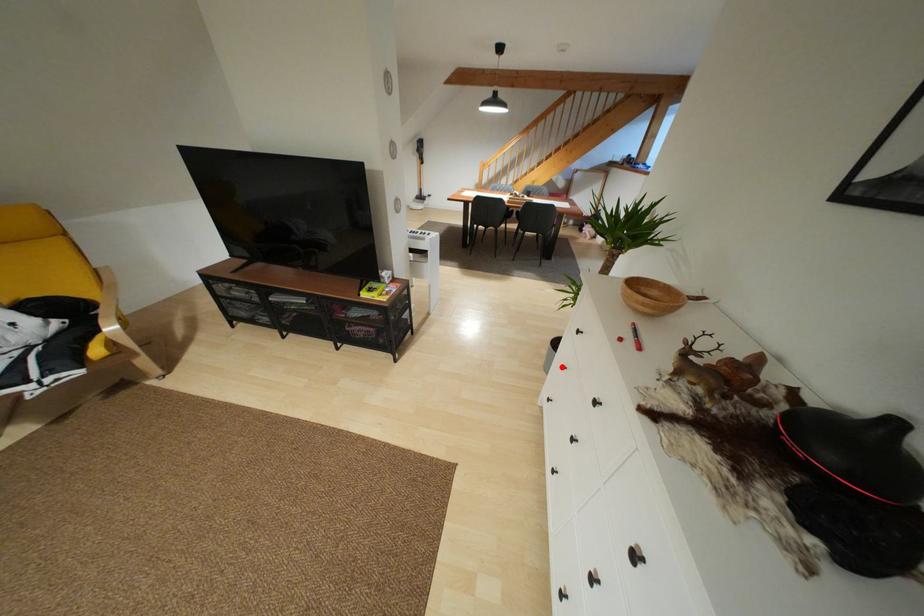
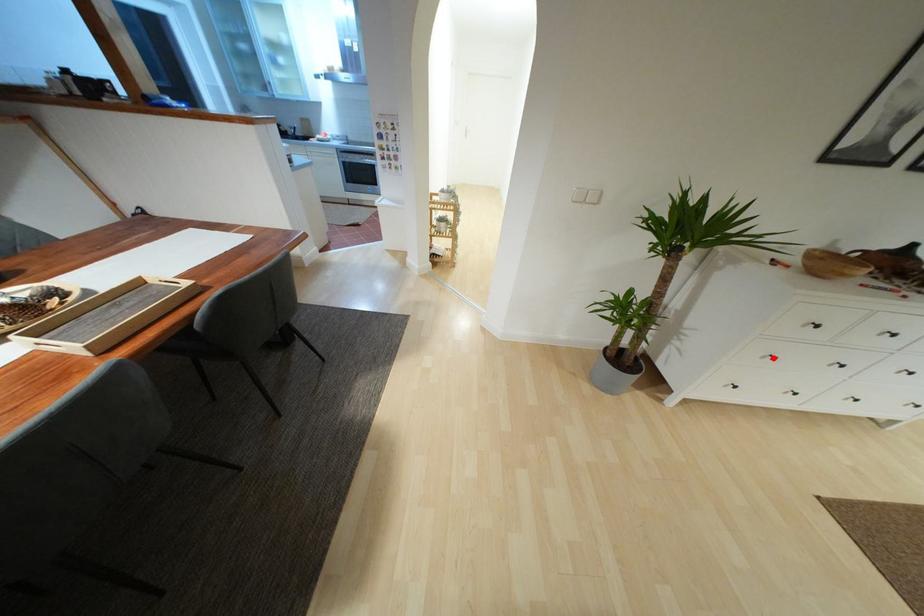
I am providing you with two images of the same scene from different viewpoints. A red point is marked on the first image and another point is marked on the second image. Are the points marked in image1 and image2 representing the same 3D position?

Yes